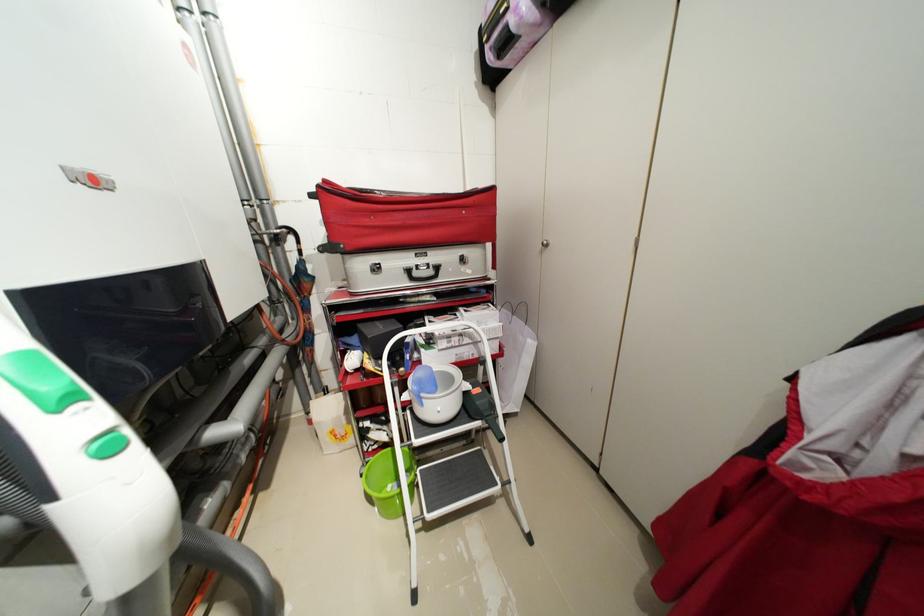
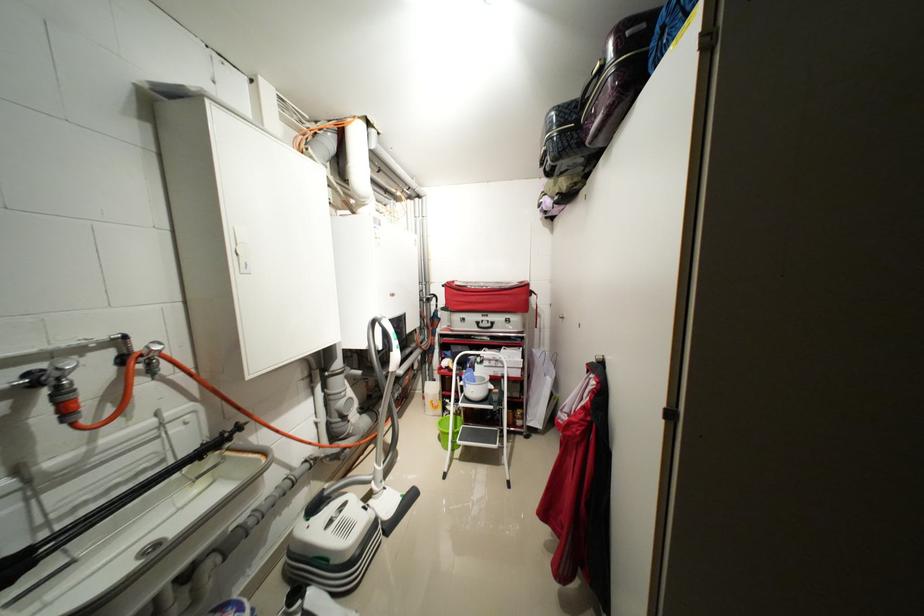
The point at (x=439, y=273) is marked in the first image. Where is the corresponding point in the second image?

(496, 326)